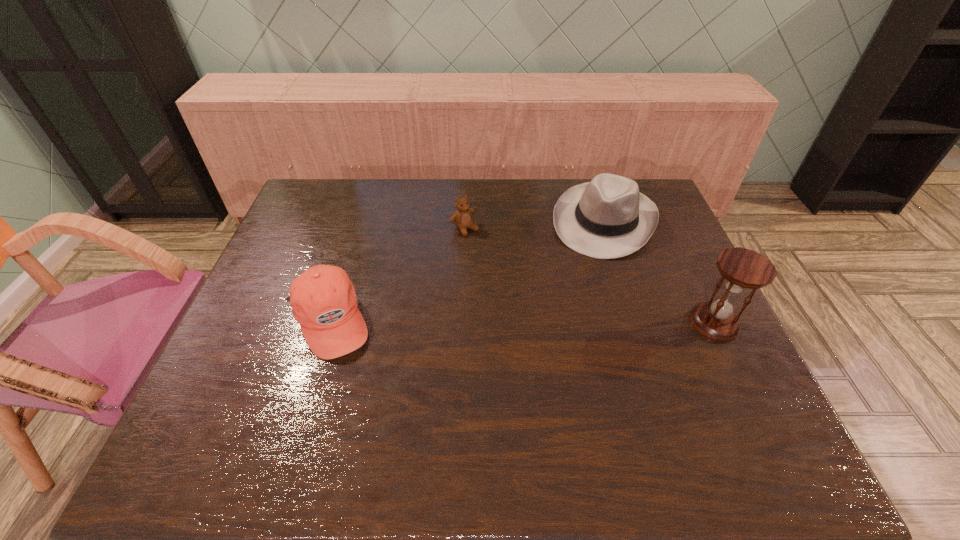
Locate an element on the screen. The width and height of the screenshot is (960, 540). vacant area that lies between the hourglass and the fedora is located at coordinates (660, 272).

What are the coordinates of `vacant space in between the shortest object and the leftmost object` in the screenshot? It's located at (397, 275).

You are a GUI agent. You are given a task and a screenshot of the screen. Output one action in this format:
    pyautogui.click(x=<x>, y=<y>)
    Task: Click on the vacant point located between the hourglass and the baseball cap
    This screenshot has height=540, width=960.
    Given the screenshot: What is the action you would take?
    pyautogui.click(x=522, y=322)

Locate an element on the screen. vacant space that is in between the shortest object and the tallest object is located at coordinates (589, 276).

You are a GUI agent. You are given a task and a screenshot of the screen. Output one action in this format:
    pyautogui.click(x=<x>, y=<y>)
    Task: Click on the unoccupied area between the fedora and the hourglass
    This screenshot has width=960, height=540.
    Given the screenshot: What is the action you would take?
    pyautogui.click(x=660, y=272)

This screenshot has width=960, height=540. I want to click on empty space between the leftmost object and the shortest object, so click(397, 275).

Where is `object that is the third closest to the tallest object`? This screenshot has width=960, height=540. object that is the third closest to the tallest object is located at coordinates 323,299.

Where is `object that can be found as the second closest to the shortest object`? Image resolution: width=960 pixels, height=540 pixels. object that can be found as the second closest to the shortest object is located at coordinates (323, 299).

Locate an element on the screen. vacant position in the image that satisfies the following two spatial constraints: 1. on the front side of the shortest object; 2. on the left side of the tallest object is located at coordinates (461, 323).

The image size is (960, 540). Identify the location of vacant region that satisfies the following two spatial constraints: 1. on the front side of the hourglass; 2. on the right side of the fedora. (637, 323).